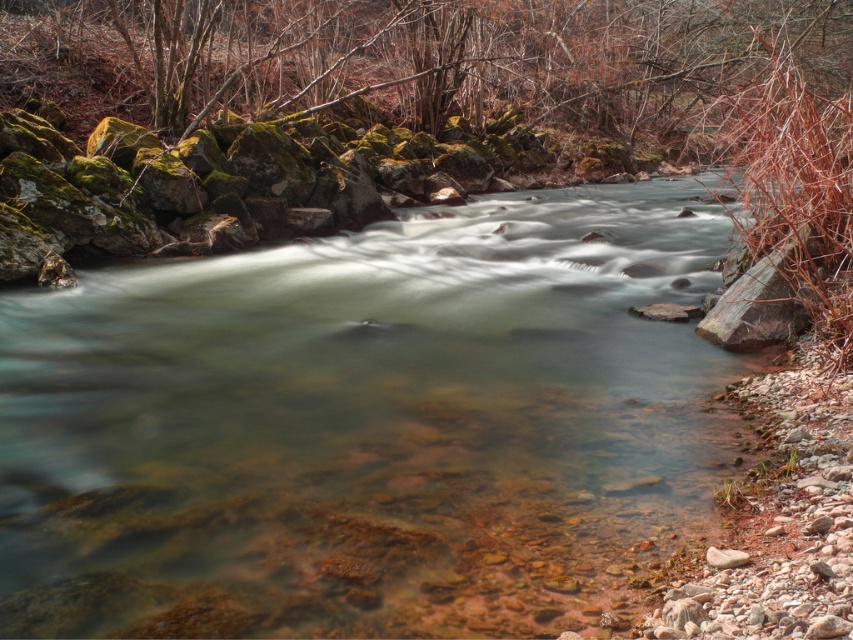
From the picture: You are standing at the point marked as point (364, 426). What is the object you are currently standing on?

You are standing on clear water at center located at point (364, 426).

You are standing at the origin point of the scene. Where is the clear water at center located in terms of coordinates?

The clear water at center is located at coordinates point (364,426).

You are standing at the edge of the stream and want to cross to the other side. You see the clear water at center and the green mossy rock at upper center. Which path would allow you to step on the wider area?

The green mossy rock at upper center has a greater width than the clear water at center, so stepping on the green mossy rock at upper center would provide a wider path for crossing.